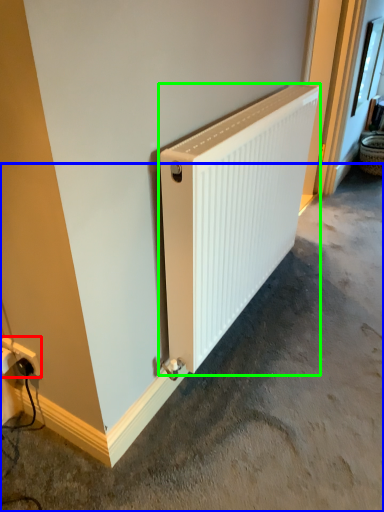
Question: Which object is the farthest from power plugs and sockets (highlighted by a red box)? Choose among these: concrete (highlighted by a blue box) or radiator (highlighted by a green box).

Choices:
 (A) concrete
 (B) radiator

Answer: (A)